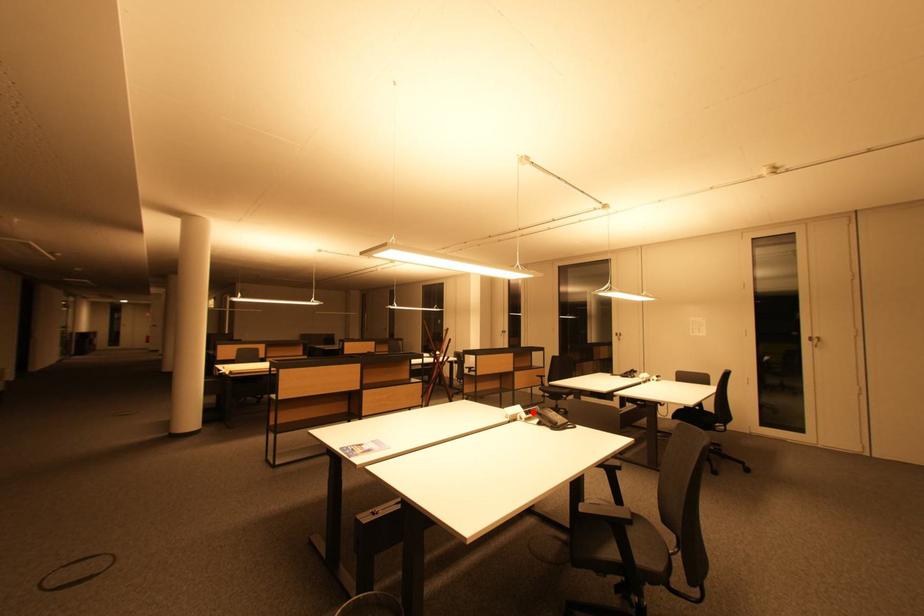
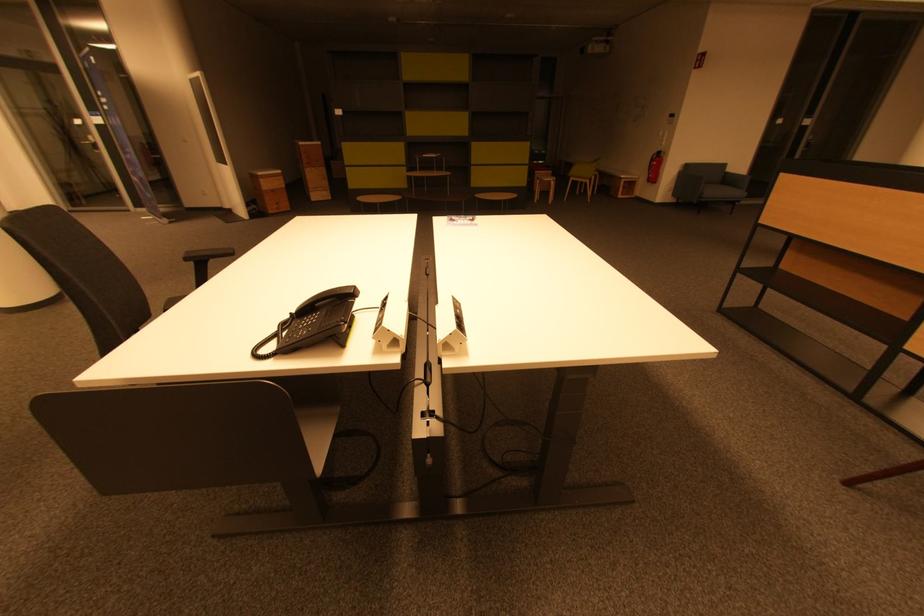
Question: I am providing you with two images of the same scene from different viewpoints. A red point is marked on the first image. Can you still see the location of the red point in image 2?

Choices:
 (A) Yes
 (B) No

Answer: (B)